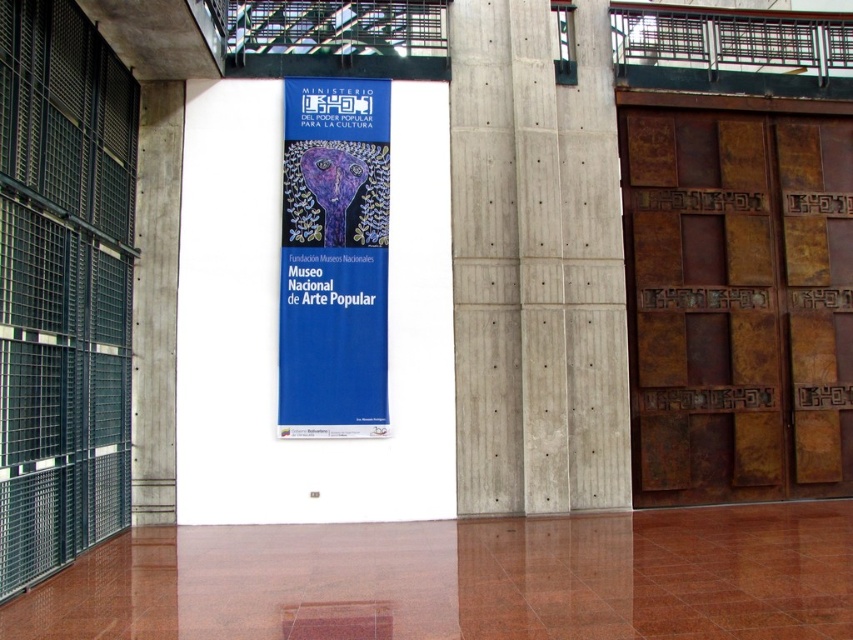
You are standing in the modern building and want to take a photo of the MINISTERIO banner. You notice two points marked on the banner at coordinates point (688, 266) and point (316, 428). Which point is closer to your camera lens when taking the photo?

Point (316, 428) is closer to the camera lens because it is positioned closer to the viewer compared to point (688, 266), which is further away.

What is the spatial relationship between the rusty metal door at right and the concrete at center in the scene?

The rusty metal door at right is positioned to the right of the concrete at center.